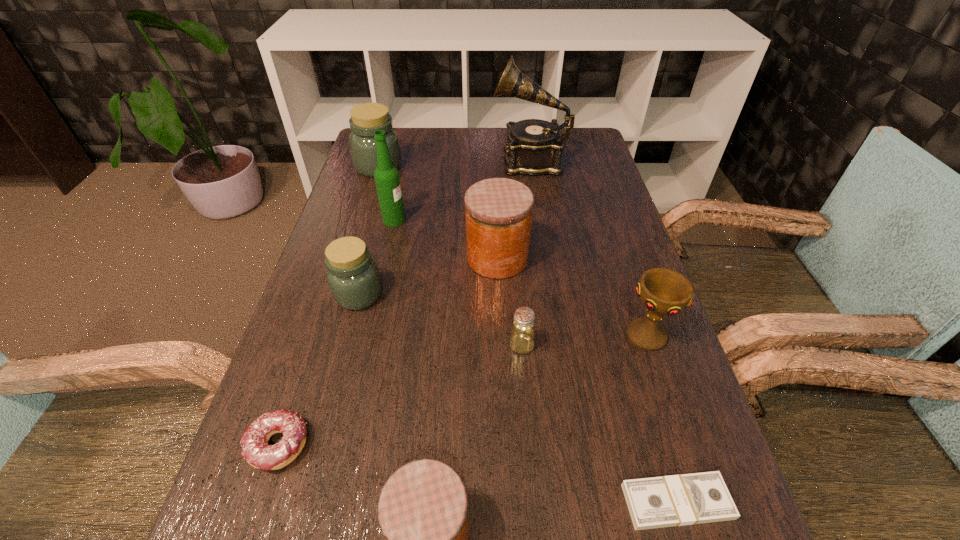
Locate an element on the screen. The height and width of the screenshot is (540, 960). the tallest object is located at coordinates coord(534,147).

The height and width of the screenshot is (540, 960). Find the location of `the second tallest object`. the second tallest object is located at coordinates (387, 180).

At what (x,y) coordinates should I click in order to perform the action: click on green beer bottle. Please return your answer as a coordinate pair (x, y). This screenshot has height=540, width=960. Looking at the image, I should click on (387, 180).

You are a GUI agent. You are given a task and a screenshot of the screen. Output one action in this format:
    pyautogui.click(x=<x>, y=<y>)
    Task: Click on the farther orange jar
    
    Given the screenshot: What is the action you would take?
    pyautogui.click(x=499, y=211)

The image size is (960, 540). I want to click on the farthest jar, so click(x=367, y=118).

The height and width of the screenshot is (540, 960). Identify the location of the bigger green jar. (367, 118).

Locate an element on the screen. The width and height of the screenshot is (960, 540). chalice is located at coordinates (663, 291).

Where is `the nearer green jar`? This screenshot has height=540, width=960. the nearer green jar is located at coordinates (353, 277).

The image size is (960, 540). In order to click on the eighth tallest object in this screenshot , I will do `click(521, 341)`.

This screenshot has height=540, width=960. I want to click on the ninth tallest object, so (x=256, y=451).